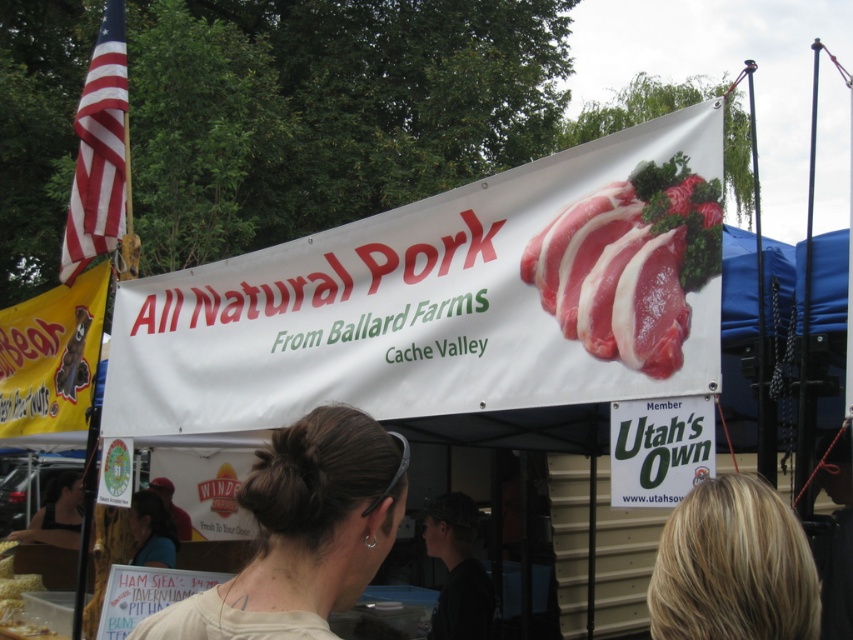
You are a customer at the market and want to know if the raw pink meat at center is wider than the blonde hair at upper center. Can you confirm this based on the description?

The raw pink meat at center is wider than the blonde hair at upper center according to the description.

You are a photographer taking a picture of the market stall. You notice two people in the scene, one with blonde hair at upper center and another with matte brown hair at lower left. Which person should you focus on to ensure they take up more of the frame?

The matte brown hair at lower left should be focused on because it occupies more space in the frame than the blonde hair at upper center.